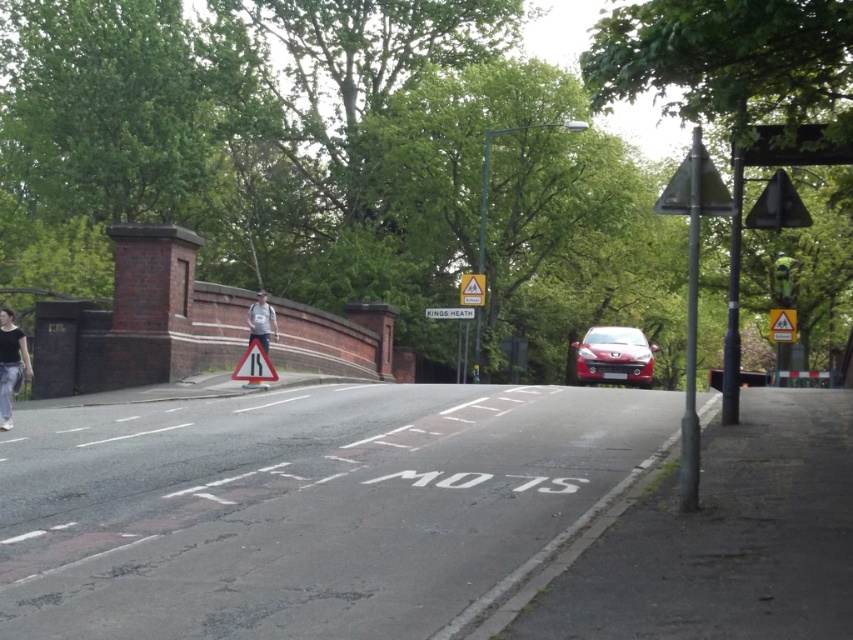
Which is in front, point (7, 380) or point (471, 312)?

Point (7, 380)

What do you see at coordinates (10, 364) in the screenshot?
I see `denim pants at lower left` at bounding box center [10, 364].

I want to click on denim pants at lower left, so click(10, 364).

Between matte red car at center and yellow reflective triangle at upper right, which one has less height?

yellow reflective triangle at upper right is shorter.

Does matte red car at center have a lesser width compared to yellow reflective triangle at upper right?

Incorrect, matte red car at center's width is not less than yellow reflective triangle at upper right's.

Identify the location of matte red car at center. This screenshot has width=853, height=640. (614, 356).

Between gray fabric jacket at center and white plastic sign at center, which one is positioned lower?

gray fabric jacket at center is below.

Between point (260, 332) and point (434, 310), which one is positioned in front?

Point (260, 332)

Is point (262, 323) positioned behind point (467, 310)?

No, it is in front of (467, 310).

Image resolution: width=853 pixels, height=640 pixels. I want to click on gray fabric jacket at center, so click(x=260, y=321).